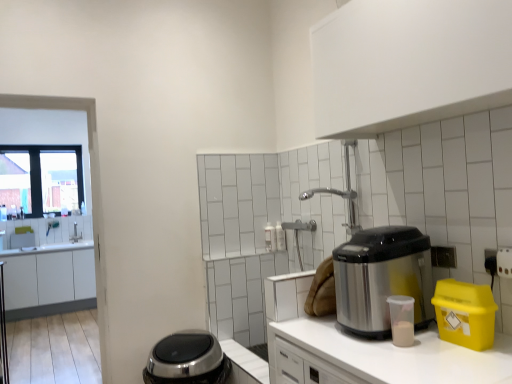
Question: Considering the relative sizes of stainless steel appliance at right and white matte countertop at center in the image provided, is stainless steel appliance at right smaller than white matte countertop at center?

Choices:
 (A) yes
 (B) no

Answer: (A)

Question: Is stainless steel appliance at right bigger than white matte countertop at center?

Choices:
 (A) no
 (B) yes

Answer: (A)

Question: Considering the relative sizes of stainless steel appliance at right and white matte countertop at center in the image provided, is stainless steel appliance at right shorter than white matte countertop at center?

Choices:
 (A) no
 (B) yes

Answer: (B)

Question: From the image's perspective, would you say stainless steel appliance at right is shown under white matte countertop at center?

Choices:
 (A) yes
 (B) no

Answer: (B)

Question: Is stainless steel appliance at right to the right of white matte countertop at center from the viewer's perspective?

Choices:
 (A) yes
 (B) no

Answer: (A)

Question: Which is correct: stainless steel appliance at right is inside white matte cabinet at left, which is the first cabinetry from left to right, or outside of it?

Choices:
 (A) outside
 (B) inside

Answer: (A)

Question: Is stainless steel appliance at right taller or shorter than white matte cabinet at left, arranged as the second cabinetry when viewed from the top?

Choices:
 (A) short
 (B) tall

Answer: (A)

Question: From the image's perspective, is stainless steel appliance at right positioned above or below white matte cabinet at left, which is the 1th cabinetry in back-to-front order?

Choices:
 (A) below
 (B) above

Answer: (B)

Question: Looking at their shapes, would you say stainless steel appliance at right is wider or thinner than white matte cabinet at left, arranged as the second cabinetry when viewed from the top?

Choices:
 (A) thin
 (B) wide

Answer: (A)

Question: From a real-world perspective, is clear glass window at upper left above or below white matte cabinet at upper center, placed as the second cabinetry when sorted from back to front?

Choices:
 (A) below
 (B) above

Answer: (A)

Question: Considering their positions, is clear glass window at upper left located in front of or behind white matte cabinet at upper center, the 1th cabinetry from the front?

Choices:
 (A) front
 (B) behind

Answer: (B)

Question: Considering the positions of point (54, 173) and point (401, 87), is point (54, 173) closer or farther from the camera than point (401, 87)?

Choices:
 (A) farther
 (B) closer

Answer: (A)

Question: Based on their positions, is clear glass window at upper left located to the left or right of white matte cabinet at upper center, arranged as the first cabinetry when viewed from the top?

Choices:
 (A) right
 (B) left

Answer: (B)

Question: Looking at their shapes, would you say satin silver appliance at lower center, the second appliance viewed from the top, is wider or thinner than white matte countertop at center?

Choices:
 (A) wide
 (B) thin

Answer: (B)

Question: Based on their sizes in the image, would you say satin silver appliance at lower center, the second appliance viewed from the top, is bigger or smaller than white matte countertop at center?

Choices:
 (A) small
 (B) big

Answer: (A)